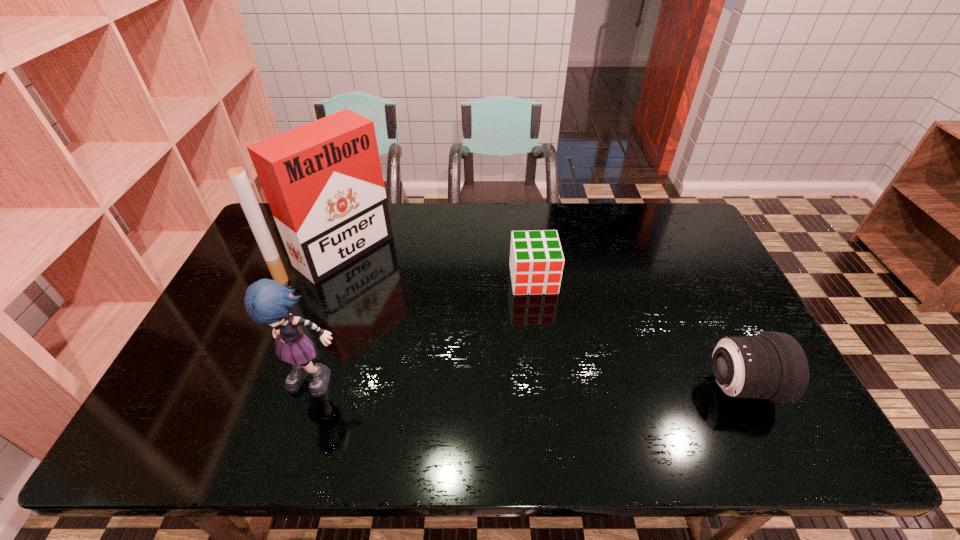
Where is `the second tallest object`? This screenshot has width=960, height=540. the second tallest object is located at coordinates (266, 301).

At what (x,y) coordinates should I click in order to perform the action: click on telephoto lens. Please return your answer as a coordinate pair (x, y). This screenshot has width=960, height=540. Looking at the image, I should click on (772, 365).

Image resolution: width=960 pixels, height=540 pixels. In order to click on the rightmost object in this screenshot , I will do `click(772, 365)`.

In order to click on cigarette case in this screenshot , I will do `click(323, 181)`.

This screenshot has width=960, height=540. Identify the location of the second object from right to left. (536, 263).

The image size is (960, 540). What are the coordinates of `cube` in the screenshot? It's located at (536, 263).

The image size is (960, 540). Find the location of `free space located on the front-facing side of the cigarette case`. free space located on the front-facing side of the cigarette case is located at coordinates (451, 332).

Image resolution: width=960 pixels, height=540 pixels. I want to click on vacant space located 0.060m on the front-facing side of the cigarette case, so click(x=383, y=282).

You are a GUI agent. You are given a task and a screenshot of the screen. Output one action in this format:
    pyautogui.click(x=<x>, y=<y>)
    Task: Click on the vacant space situated on the front-facing side of the cigarette case
    
    Given the screenshot: What is the action you would take?
    pyautogui.click(x=448, y=329)

Identify the location of vacant region located on the red face of the third object from left to right. This screenshot has width=960, height=540. (543, 335).